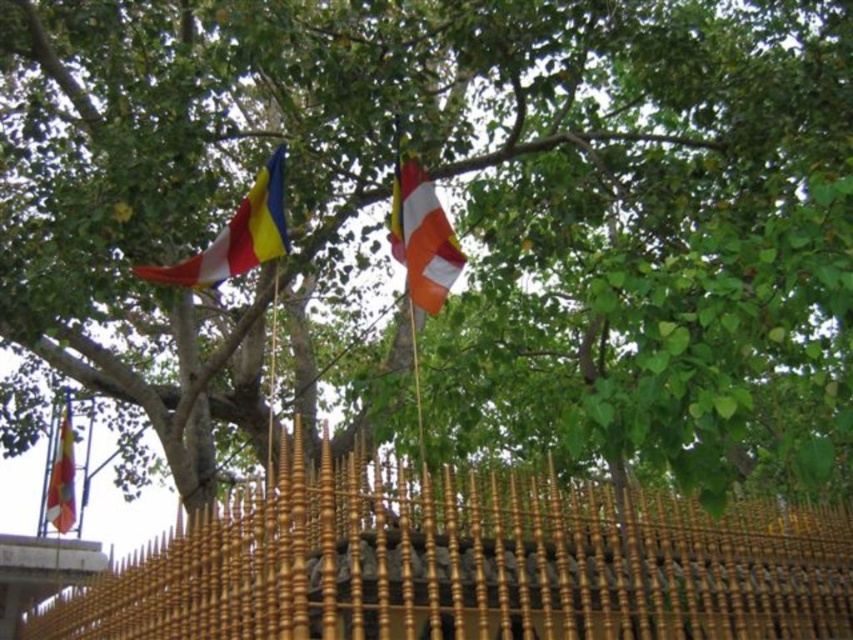
You are standing at the base of the golden railing and want to place a small statue on the gold polished wood fence at lower center. Can you see the matte fabric flag at upper left from that position?

Yes, because the gold polished wood fence at lower center is located below the matte fabric flag at upper left, so placing the statue on the fence would allow visibility of the flag above.

You are standing in front of the golden railing and looking at the gold polished wood fence at lower center and the matte yellow flag at lower left. Which object takes up more space in the scene?

The matte yellow flag at lower left occupies more space than the gold polished wood fence at lower center.

You are standing at the point marked by the coordinates point (236,236) in the image. Looking around, you see the matte fabric flag at upper left and the golden railing in the foreground. Which object is closer to you?

The point (236,236) indicates the matte fabric flag at upper left, so you are standing at that flag. Therefore, the matte fabric flag at upper left is right where you are standing, making it the closest object to you.